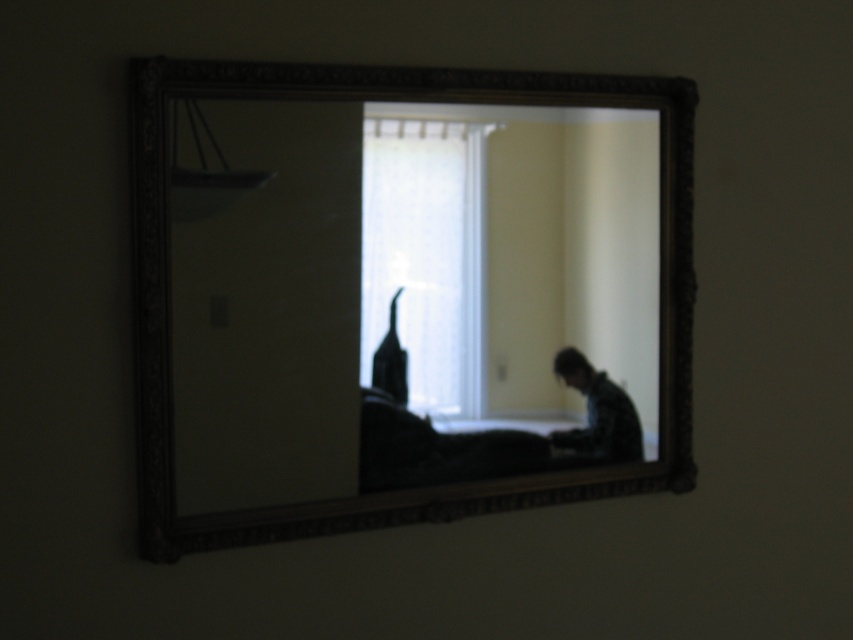
You are standing in the room depicted in the image and want to move closer to the white sheer curtain at center without walking through the wooden frame mirror at center. Which direction should you move relative to the mirror?

The wooden frame mirror at center is to the right of the white sheer curtain at center. To reach the curtain without passing through the mirror, you should move to the left side of the mirror.

You are standing in front of the mirror and see a point marked at coordinates (403, 294). Where is this point located in relation to the wooden frame mirror at center?

The point at (403, 294) is located on the wooden frame mirror at center.

You are standing in a room with a wooden frame mirror at center. If you want to place a small decorative item exactly where the mirror is located, what coordinates should you aim for?

You should aim for the coordinates point (403, 294) where the wooden frame mirror at center is located.